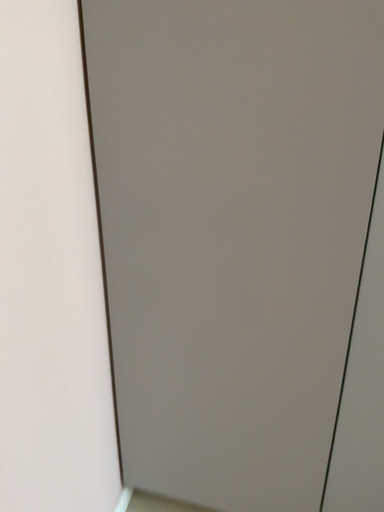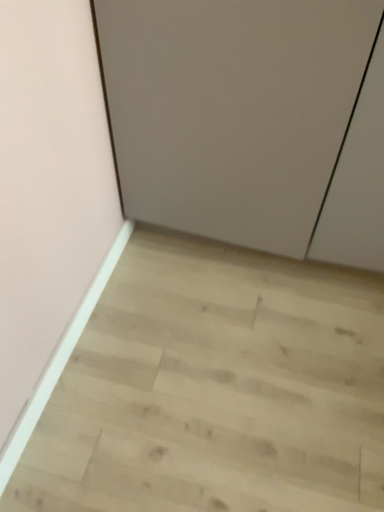
Question: Which way did the camera rotate in the video?

Choices:
 (A) rotated upward
 (B) rotated downward

Answer: (B)